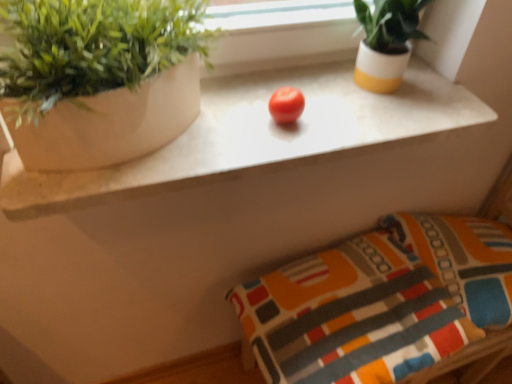
At what (x,y) coordinates should I click in order to perform the action: click on vacant area in front of red matte tomato at center. Please return your answer as a coordinate pair (x, y). Looking at the image, I should click on (269, 147).